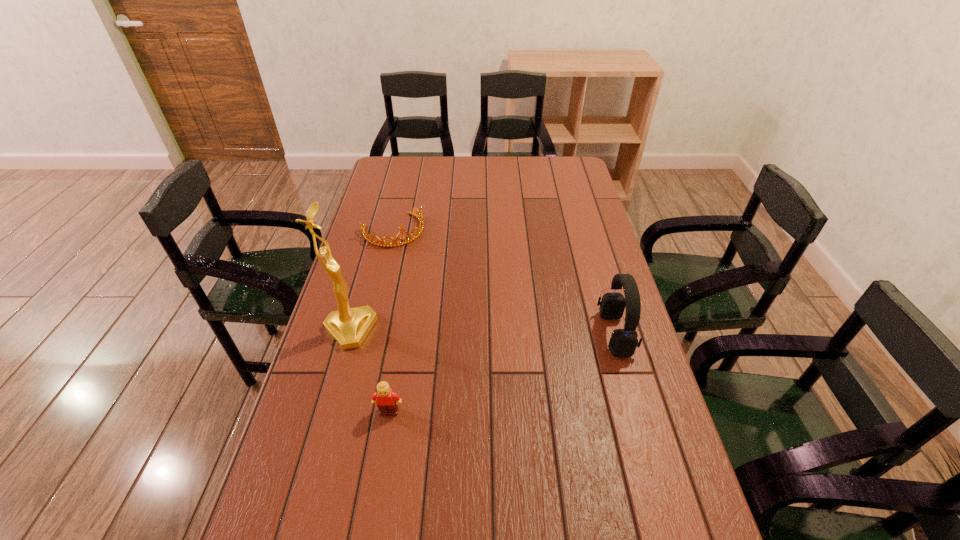
This screenshot has height=540, width=960. Identify the location of free region at the far edge of the desktop. (514, 165).

The image size is (960, 540). What are the coordinates of `vacant space at the left edge` in the screenshot? It's located at (382, 205).

Find the location of a particular element. The width and height of the screenshot is (960, 540). free space at the right edge of the desktop is located at coordinates (603, 233).

This screenshot has height=540, width=960. What are the coordinates of `blank space at the near left corner of the desktop` in the screenshot? It's located at tap(282, 507).

Where is `free space at the far right corner of the desktop`? free space at the far right corner of the desktop is located at coordinates (577, 168).

The height and width of the screenshot is (540, 960). What are the coordinates of `free space that is in between the headset and the farthest object` in the screenshot? It's located at (504, 282).

This screenshot has height=540, width=960. I want to click on free area in between the third tallest object and the farthest object, so click(x=391, y=321).

Image resolution: width=960 pixels, height=540 pixels. Identify the location of free space between the rightmost object and the Lego. (502, 373).

At what (x,y) coordinates should I click in order to perform the action: click on free space between the rightmost object and the award. Please return your answer as a coordinate pair (x, y). The image size is (960, 540). Looking at the image, I should click on (482, 332).

Where is `free spot between the Lego and the shortest object`? The height and width of the screenshot is (540, 960). free spot between the Lego and the shortest object is located at coordinates (391, 321).